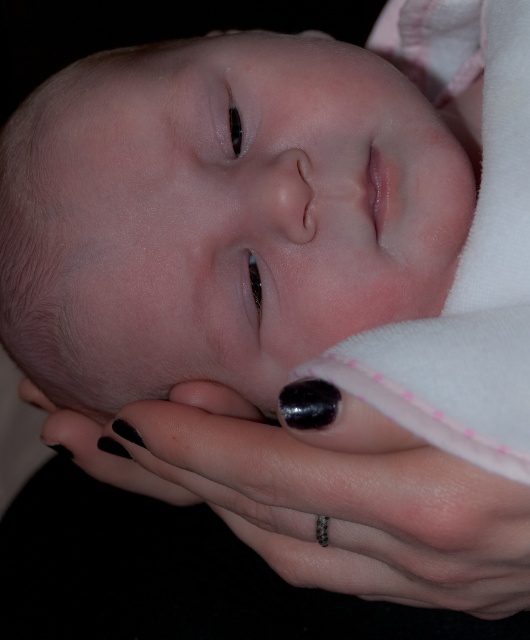
Based on the scene description, where is the smooth skin baby at center located in terms of coordinates?

The smooth skin baby at center is located at coordinates point (219, 214).

Looking at the image of a newborn baby wrapped in a pink blanket, you notice the smooth skin baby at center and the black polished nail at lower center. Which object in the scene is bigger?

The smooth skin baby at center is bigger than the black polished nail at lower center.

You are a photographer adjusting the lighting for a newborn photo session. The smooth skin baby at center and the black polished nail at lower center are in your frame. You need to ensure there is at least 5 inches of space between them for proper lighting. Is the current distance sufficient?

The smooth skin baby at center and the black polished nail at lower center are 4.61 inches apart, which is less than the required 5 inches. Therefore, the current distance is insufficient for proper lighting.